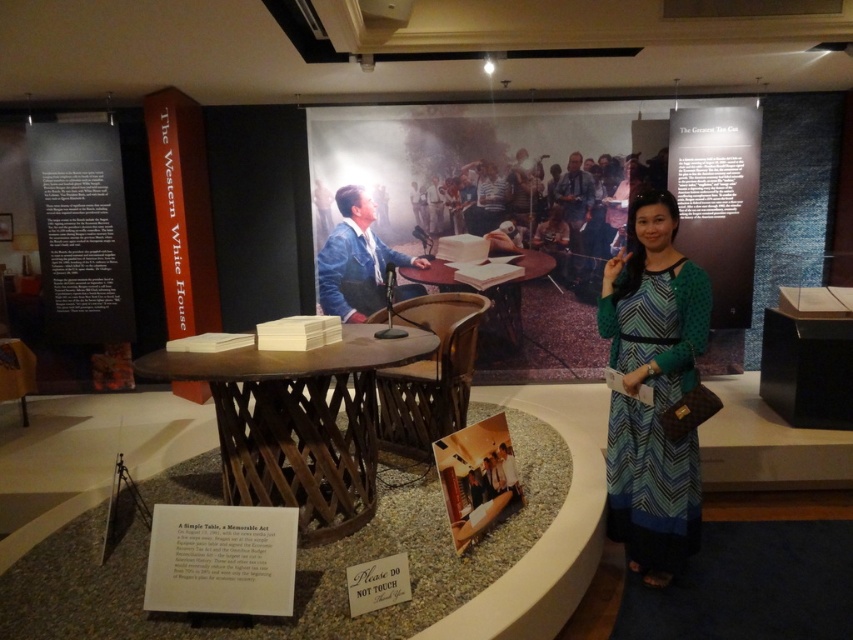
You are a photographer at the museum exhibit and need to capture both the green zigzag dress at center and the matte blue shirt at center in a single photo. Which clothing item should you focus on first to ensure it appears taller in the frame?

The green zigzag dress at center has a greater height compared to the matte blue shirt at center, so focusing on it first will ensure it appears taller in the frame.

You are an event organizer planning to set up a presentation at the museum. You need to place a large banner between the wooden round table at center and the light brown wood table at center. Which table should the banner be placed closer to in order to avoid blocking the view of the large photographic mural in the background?

The wooden round table at center is positioned under the light brown wood table at center. To avoid blocking the view of the large photographic mural in the background, the banner should be placed closer to the wooden round table at center so it doesn not obstruct the line of sight to the mural.